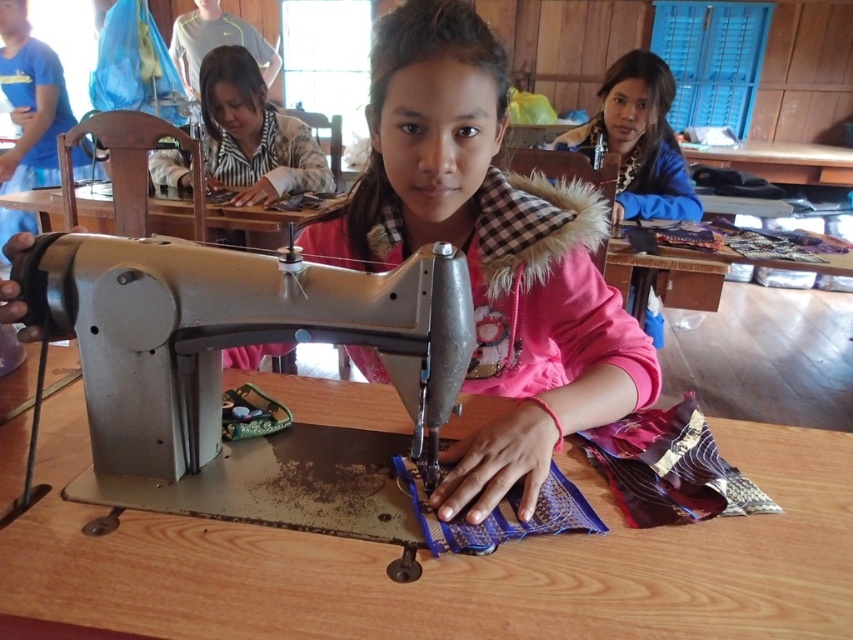
You are organizing a sewing workshop and need to arrange the metallic sewing machine at center and the blue fuzzy jacket at upper right in a storage area. If the storage space has a height limit of 1 meter, can both items fit vertically without stacking?

The metallic sewing machine at center has a smaller size compared to blue fuzzy jacket at upper right. However, without specific height measurements for each item, it is impossible to determine if they can fit vertically within the 1 meter limit. Additional information about their individual heights is required.